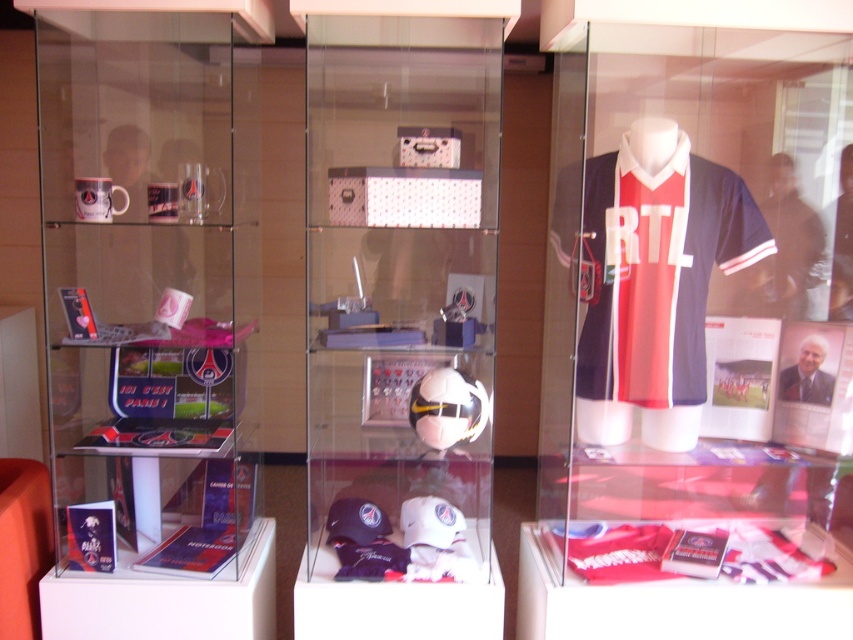
You are a visitor standing in front of the display case. You want to take a photo of the matte jersey at center and the white glossy soccer ball at center. Which object should you focus on first if you want to capture both in the same frame without moving your camera?

The matte jersey at center is located below the white glossy soccer ball at center. Since the jersey is lower, you should focus on the white glossy soccer ball at center first to ensure both are in the frame without moving the camera.